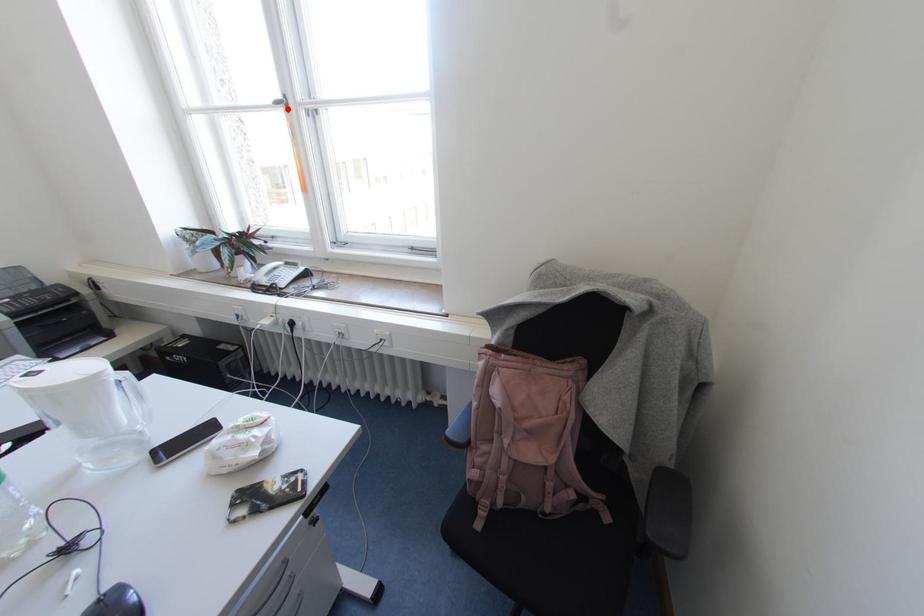
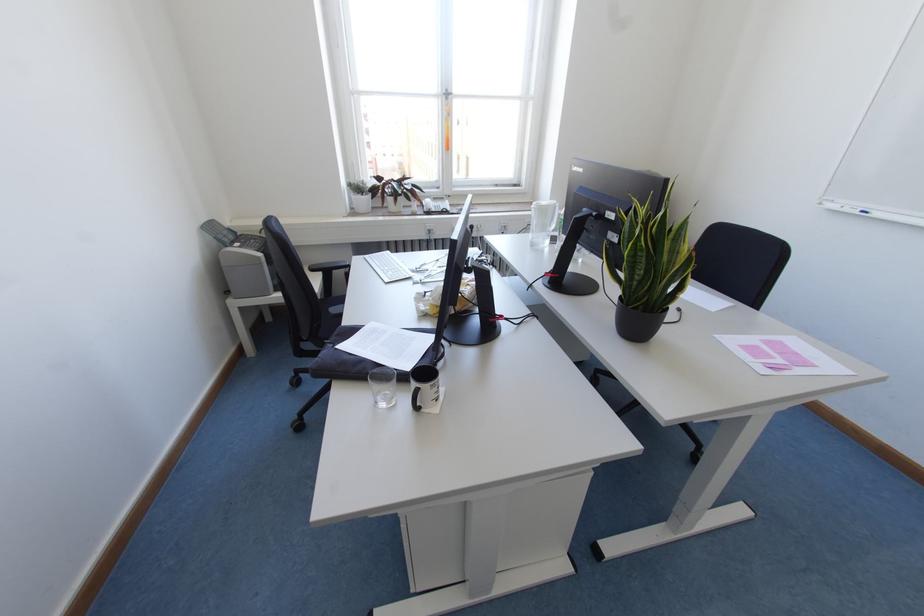
Question: I am providing you with two images of the same scene from different viewpoints. A red point is shown in image1. For the corresponding object point in image2, is it positioned nearer or farther from the camera?

Choices:
 (A) Nearer
 (B) Farther

Answer: (A)